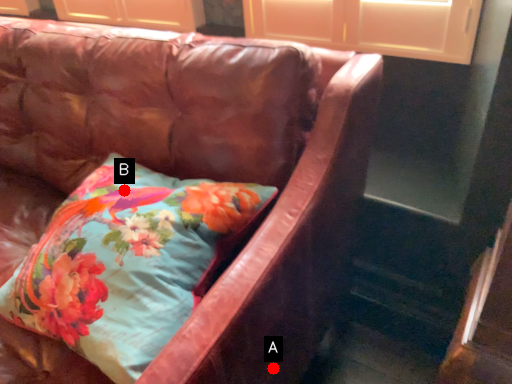
Question: Two points are circled on the image, labeled by A and B beside each circle. Among these points, which one is nearest to the camera?

Choices:
 (A) A is closer
 (B) B is closer

Answer: (A)